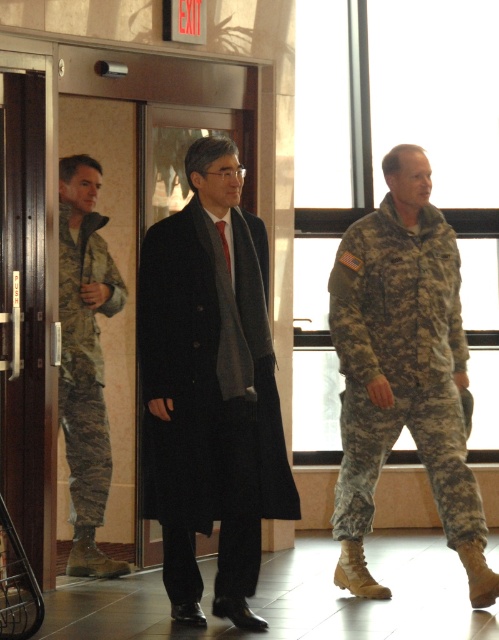
You are standing in the corridor and want to move towards the glass door with the exit sign. Which point, point (254, 532) or point (82, 404), is closer to you as you face the door?

Point (254, 532) is closer to the viewer than point (82, 404).

You are a security guard in the facility. You need to check the thickness of the black wool coat at center and the camouflage uniform at right. Which one is thinner?

The black wool coat at center is thinner than the camouflage uniform at right.